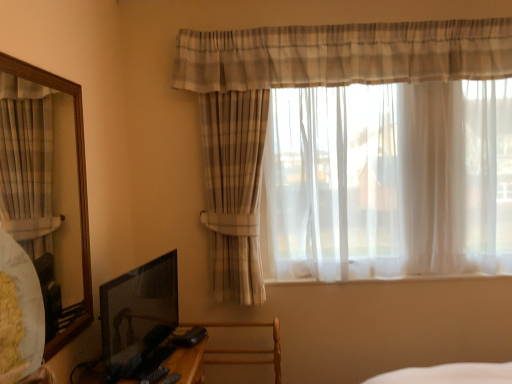
The width and height of the screenshot is (512, 384). I want to click on vacant area on top of wooden mirror at left (from a real-world perspective), so [x=40, y=58].